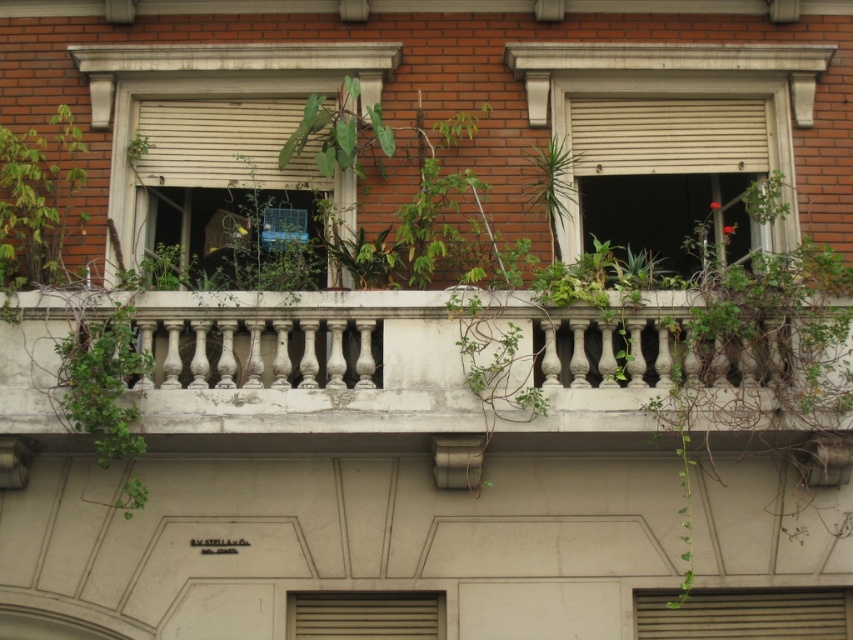
Consider the image. Between white stone railing at center and matte white window at center, which one is positioned higher?

Positioned higher is matte white window at center.

Is white stone railing at center above matte white window at center?

No.

Is point (300, 371) in front of point (207, 67)?

Yes, it is.

Where is `white stone railing at center`? This screenshot has width=853, height=640. white stone railing at center is located at coordinates [300, 364].

Who is taller, white stone railing at center or white matte window at upper right?

white matte window at upper right is taller.

How distant is white stone railing at center from white matte window at upper right?

white stone railing at center is 2.15 meters away from white matte window at upper right.

I want to click on white stone railing at center, so click(300, 364).

Between white stone railing at center and matte gray vent at center, which one is positioned higher?

white stone railing at center is above.

Is white stone railing at center bigger than matte gray vent at center?

Yes, white stone railing at center is bigger than matte gray vent at center.

Which is in front, point (517, 310) or point (383, 636)?

Point (517, 310) is in front.

What are the coordinates of `white stone railing at center` in the screenshot? It's located at (300, 364).